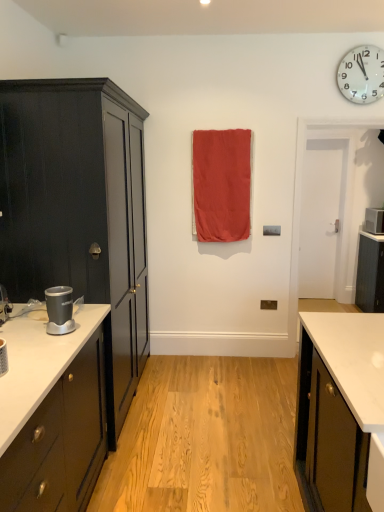
Question: Considering the relative sizes of silver metallic blender at left, the first appliance positioned from the front, and white plastic microwave at right, arranged as the 1th appliance when viewed from the back, in the image provided, is silver metallic blender at left, the first appliance positioned from the front, wider than white plastic microwave at right, arranged as the 1th appliance when viewed from the back,?

Choices:
 (A) no
 (B) yes

Answer: (A)

Question: Is silver metallic blender at left, which is the first appliance in bottom-to-top order, thinner than white plastic microwave at right, placed as the second appliance when sorted from left to right?

Choices:
 (A) yes
 (B) no

Answer: (A)

Question: Does silver metallic blender at left, which is the first appliance in bottom-to-top order, appear on the right side of white plastic microwave at right, the first appliance from the right?

Choices:
 (A) yes
 (B) no

Answer: (B)

Question: From a real-world perspective, is silver metallic blender at left, the first appliance positioned from the front, physically above white plastic microwave at right, arranged as the 1th appliance when viewed from the back?

Choices:
 (A) no
 (B) yes

Answer: (A)

Question: Is silver metallic blender at left, which is the second appliance in back-to-front order, facing towards white plastic microwave at right, arranged as the 1th appliance when viewed from the back?

Choices:
 (A) yes
 (B) no

Answer: (B)

Question: From the image's perspective, relative to silver metallic blender at left, which is the first appliance in bottom-to-top order, is matte red fabric at center above or below?

Choices:
 (A) below
 (B) above

Answer: (B)

Question: Is matte red fabric at center spatially inside silver metallic blender at left, which is counted as the 2th appliance, starting from the right, or outside of it?

Choices:
 (A) inside
 (B) outside

Answer: (B)

Question: Is point (246, 201) positioned closer to the camera than point (49, 296)?

Choices:
 (A) closer
 (B) farther

Answer: (B)

Question: Is matte red fabric at center bigger or smaller than silver metallic blender at left, which is counted as the 2th appliance, starting from the right?

Choices:
 (A) big
 (B) small

Answer: (A)

Question: From a real-world perspective, is white plastic microwave at right, the 2th appliance in the front-to-back sequence, above or below white plastic wall clock at upper right?

Choices:
 (A) above
 (B) below

Answer: (B)

Question: In the image, is white plastic microwave at right, which appears as the first appliance when viewed from the top, positioned in front of or behind white plastic wall clock at upper right?

Choices:
 (A) behind
 (B) front

Answer: (A)

Question: In the image, is white plastic microwave at right, placed as the second appliance when sorted from left to right, on the left side or the right side of white plastic wall clock at upper right?

Choices:
 (A) left
 (B) right

Answer: (B)

Question: Looking at their shapes, would you say white plastic microwave at right, the first appliance from the right, is wider or thinner than white plastic wall clock at upper right?

Choices:
 (A) thin
 (B) wide

Answer: (B)

Question: Is white plastic wall clock at upper right wider or thinner than matte red fabric at center?

Choices:
 (A) wide
 (B) thin

Answer: (B)

Question: From a real-world perspective, is white plastic wall clock at upper right physically located above or below matte red fabric at center?

Choices:
 (A) below
 (B) above

Answer: (B)